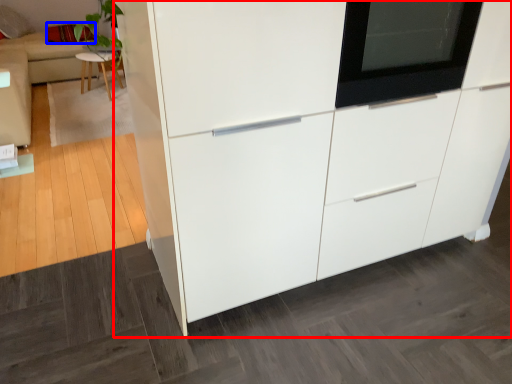
Question: Which point is further to the camera, cabinetry (highlighted by a red box) or pillow (highlighted by a blue box)?

Choices:
 (A) cabinetry
 (B) pillow

Answer: (B)